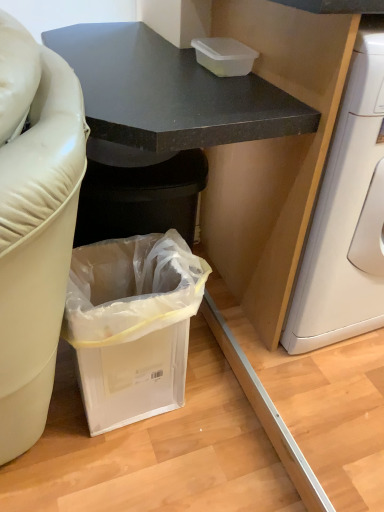
Where is `vacant area to the right of clear plastic trash can at lower left`? The image size is (384, 512). vacant area to the right of clear plastic trash can at lower left is located at coordinates (235, 422).